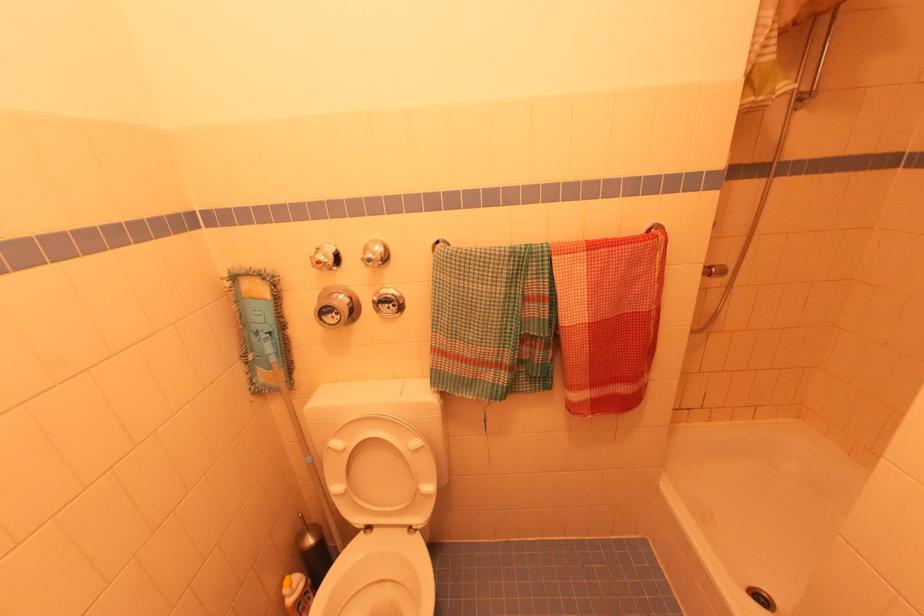
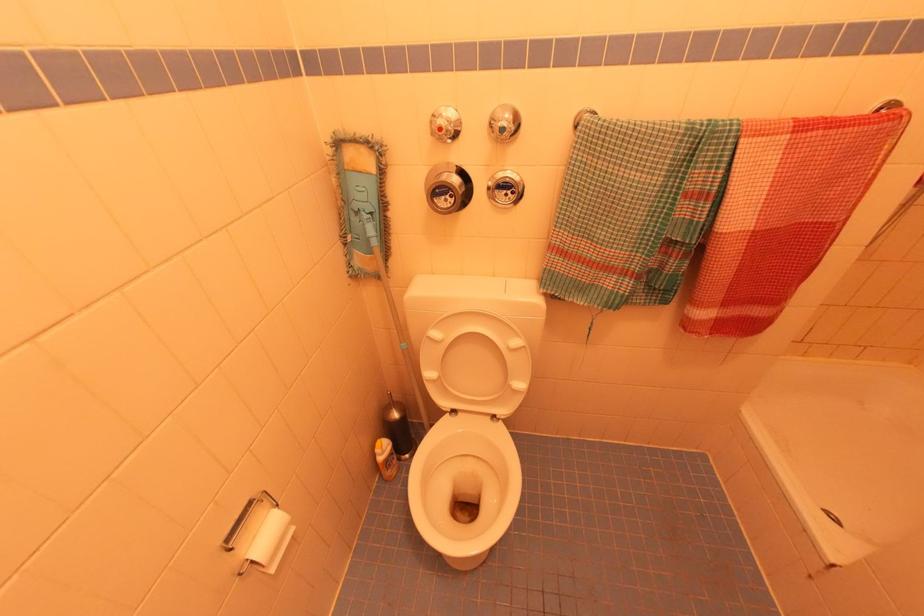
In the second image, find the point that corresponds to pixel 327 257 in the first image.

(450, 123)